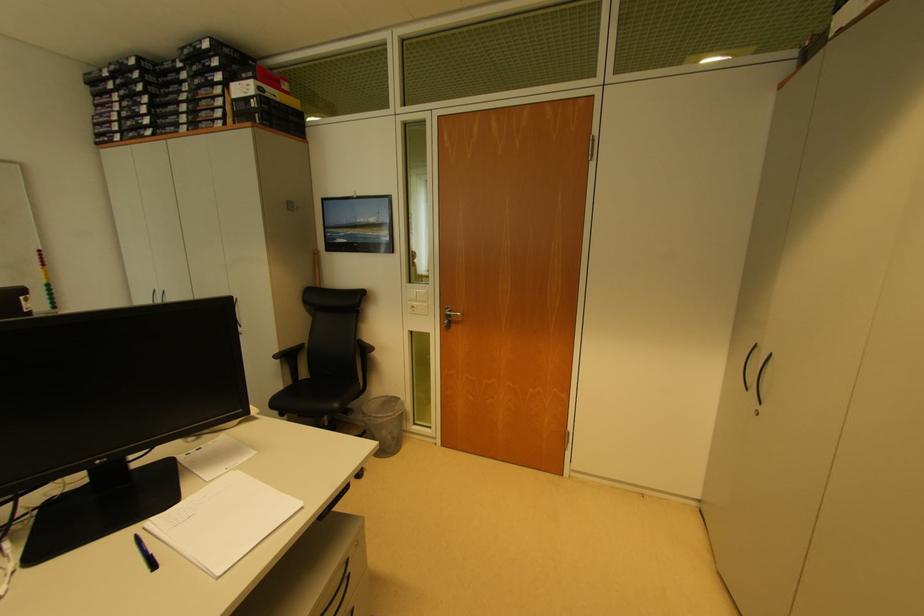
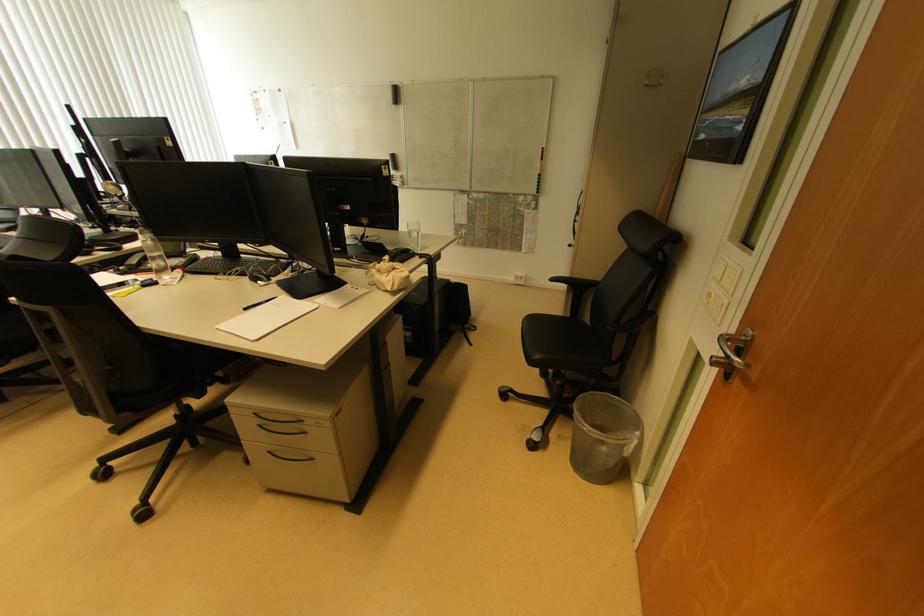
Find the pixel in the second image that matches (x=405, y=403) in the first image.

(639, 437)